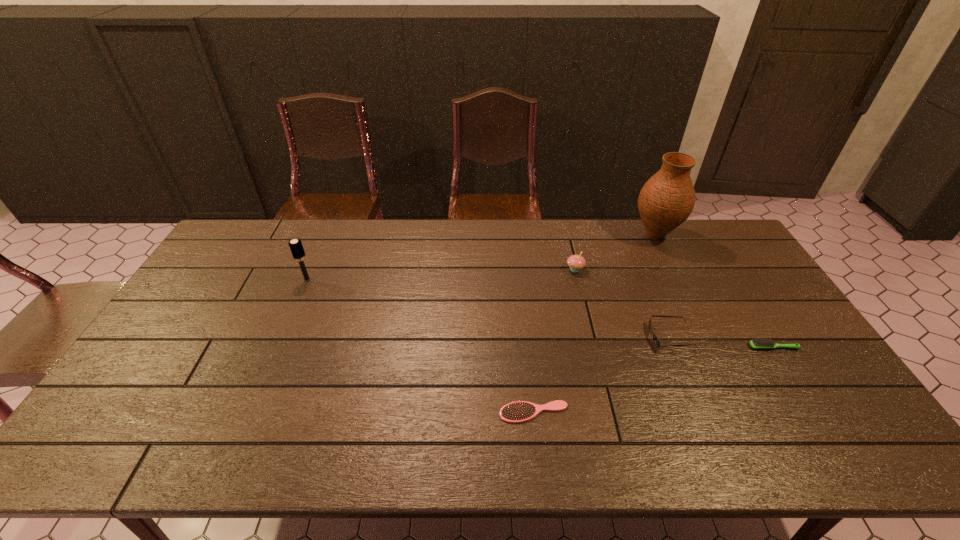
You are a GUI agent. You are given a task and a screenshot of the screen. Output one action in this format:
    pyautogui.click(x=<x>, y=<y>)
    Task: Click on the fifth object from right to left
    Image resolution: width=960 pixels, height=540 pixels.
    Given the screenshot: What is the action you would take?
    (520, 411)

Where is `vacant region located on the left of the tallest object`? vacant region located on the left of the tallest object is located at coordinates (522, 236).

Locate an element on the screen. Image resolution: width=960 pixels, height=540 pixels. blank area located 0.080m on the left of the leftmost object is located at coordinates (276, 279).

This screenshot has height=540, width=960. Identify the location of vacant position located 0.200m on the front of the cupcake. (588, 320).

The image size is (960, 540). I want to click on free space located 0.180m on the lenses of the fourth tallest object, so click(588, 338).

Where is `vacant area located on the lenses of the fourth tallest object`? The height and width of the screenshot is (540, 960). vacant area located on the lenses of the fourth tallest object is located at coordinates (564, 338).

You are a GUI agent. You are given a task and a screenshot of the screen. Output one action in this format:
    pyautogui.click(x=<x>, y=<y>)
    Task: Click on the vacant area located on the lenses of the fourth tallest object
    This screenshot has width=960, height=540.
    Given the screenshot: What is the action you would take?
    pyautogui.click(x=634, y=338)

This screenshot has height=540, width=960. Find the location of `free space located 0.270m on the front of the second farthest hairbrush`. free space located 0.270m on the front of the second farthest hairbrush is located at coordinates (832, 442).

Where is `vacant space situated 0.160m on the left of the second hairbrush from right to left`? vacant space situated 0.160m on the left of the second hairbrush from right to left is located at coordinates (435, 412).

Image resolution: width=960 pixels, height=540 pixels. I want to click on object that is at the far edge, so click(x=667, y=199).